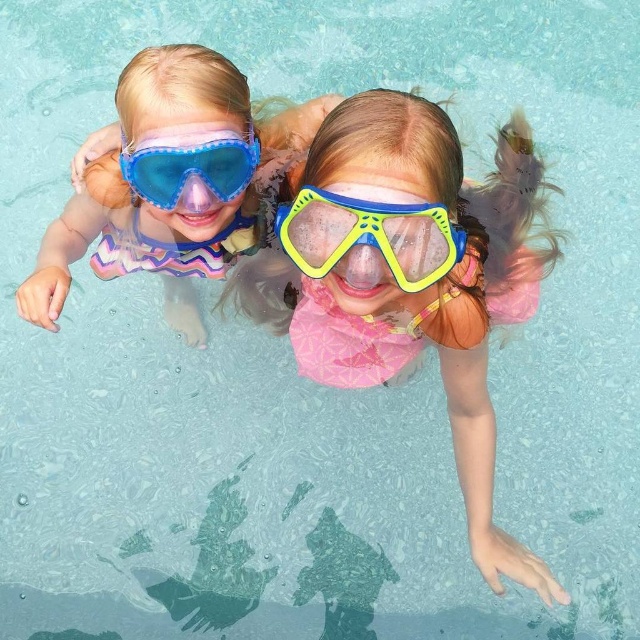
Question: Is blue rubber swimming mask at center below yellow translucent goggles at center?

Choices:
 (A) no
 (B) yes

Answer: (B)

Question: Which of these objects is positioned closest to the transparent plastic goggles at upper center?

Choices:
 (A) matte blue plastic goggles at upper center
 (B) blue rubber swimming mask at center
 (C) yellow translucent goggles at center

Answer: (A)

Question: Can you confirm if yellow translucent goggles at center is wider than transparent plastic goggles at upper center?

Choices:
 (A) no
 (B) yes

Answer: (B)

Question: Among these points, which one is nearest to the camera?

Choices:
 (A) (200, 141)
 (B) (339, 285)
 (C) (426, 276)

Answer: (C)

Question: Which point is farther from the camera taking this photo?

Choices:
 (A) (365, 356)
 (B) (202, 260)
 (C) (172, 180)

Answer: (B)

Question: Does yellow translucent goggles at center have a larger size compared to transparent plastic goggles at upper center?

Choices:
 (A) yes
 (B) no

Answer: (A)